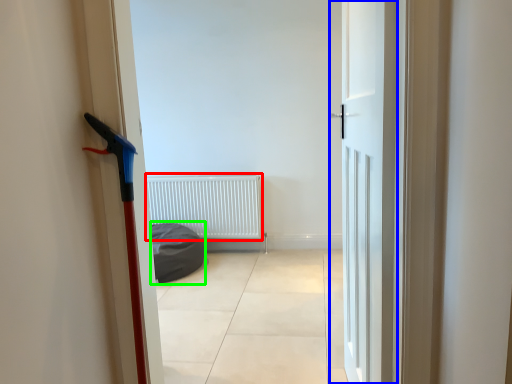
Question: Which object is the farthest from radiator (highlighted by a red box)? Choose among these: door (highlighted by a blue box) or sleeping bag (highlighted by a green box).

Choices:
 (A) door
 (B) sleeping bag

Answer: (A)